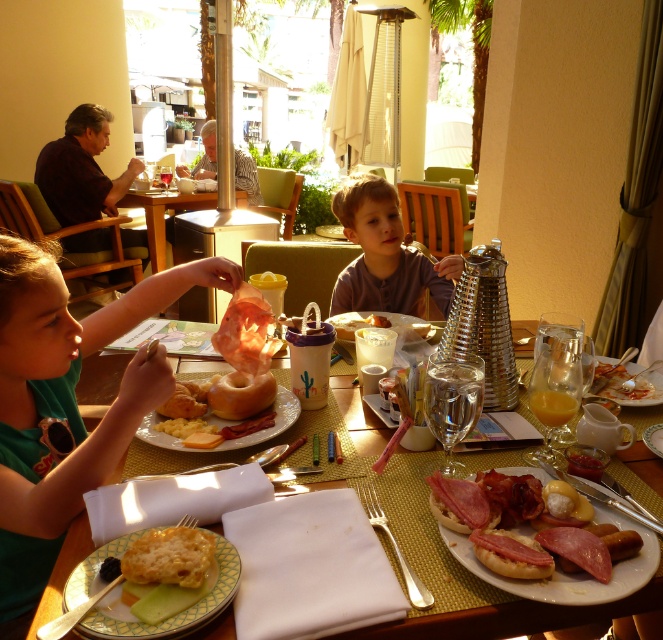
You are a food server at the breakfast table. You need to place a new dish between the smooth pink ham at center and the matte brown bagel at center. Which direction should you place it to ensure it goes between them?

The smooth pink ham at center is below the matte brown bagel at center, so placing the new dish above the ham and below the bagel would position it between them.